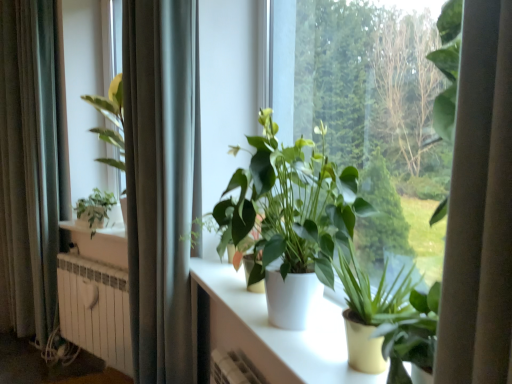
Question: Considering the relative positions of silky gray curtain at left, the second curtain in the right-to-left sequence, and white glossy table at center in the image provided, is silky gray curtain at left, the second curtain in the right-to-left sequence, to the left or to the right of white glossy table at center?

Choices:
 (A) right
 (B) left

Answer: (B)

Question: Is point (3, 77) closer or farther from the camera than point (284, 339)?

Choices:
 (A) farther
 (B) closer

Answer: (A)

Question: Considering the real-world distances, which object is farthest from the green matte plant at left, marked as the third houseplant in a right-to-left arrangement?

Choices:
 (A) white metallic radiator at lower left
 (B) white glossy table at center
 (C) green matte plant at center, the third houseplant when ordered from back to front
 (D) gray fabric curtain at left, placed as the 2th curtain when sorted from back to front
 (E) white matte plant pot at center, which appears as the 2th houseplant when viewed from the front

Answer: (C)

Question: Which is nearer to the white metallic radiator at lower left?

Choices:
 (A) green matte plant at left, marked as the third houseplant in a right-to-left arrangement
 (B) gray fabric curtain at left, the first curtain when ordered from front to back
 (C) white matte plant pot at center, the second houseplant from the back
 (D) green matte plant at center, which is the 3th houseplant from left to right
 (E) silky gray curtain at left, the second curtain in the right-to-left sequence

Answer: (A)